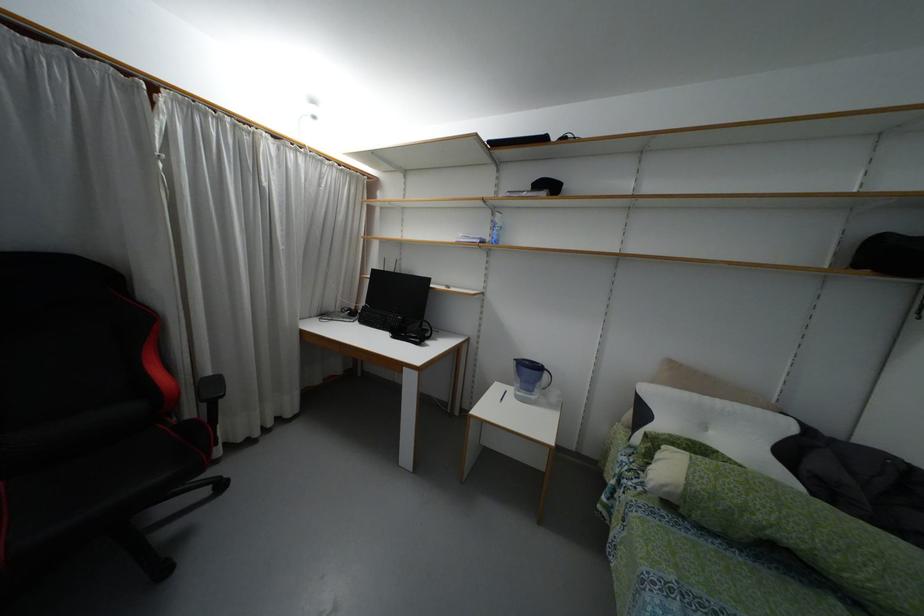
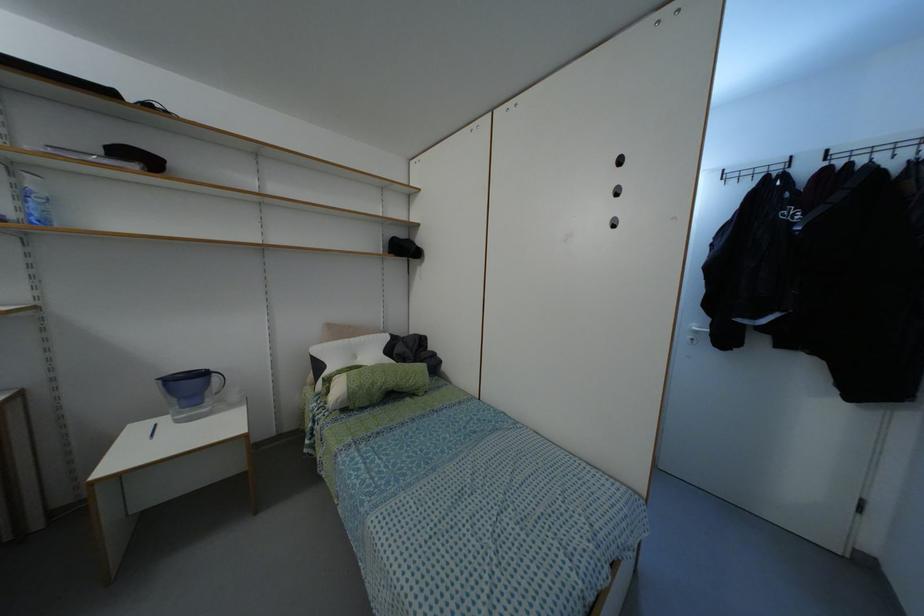
Find the pixel in the second image that matches [544,375] in the first image.

(214, 378)